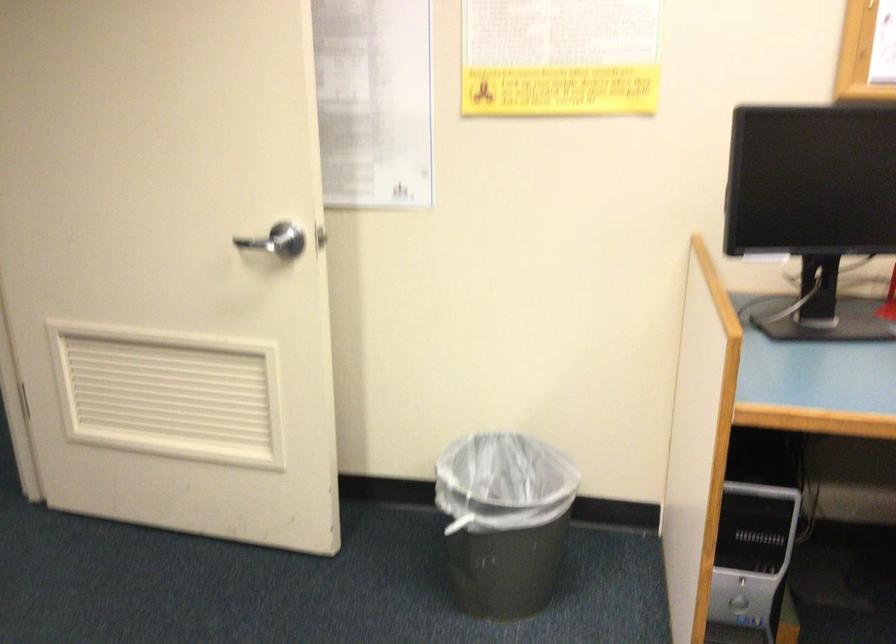
Locate an element on the screen. The height and width of the screenshot is (644, 896). computer power button is located at coordinates (737, 601).